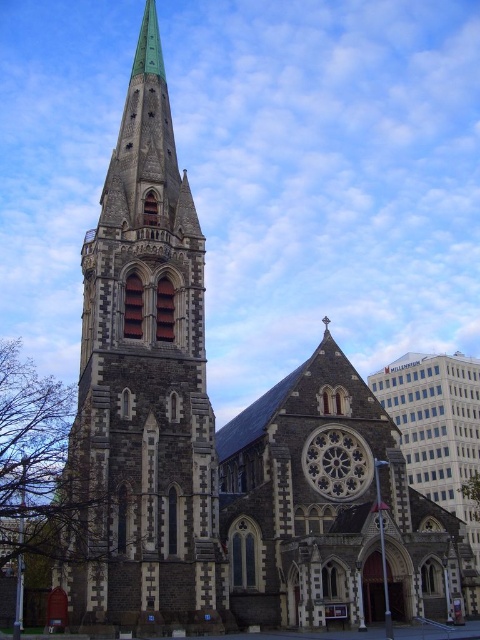
Question: Does stone steeple at left have a greater width compared to dark gray stone clock at center?

Choices:
 (A) yes
 (B) no

Answer: (A)

Question: Can you confirm if stone steeple at left is positioned to the right of dark gray stone clock at center?

Choices:
 (A) yes
 (B) no

Answer: (B)

Question: Can you confirm if stone steeple at left is smaller than dark gray stone clock at center?

Choices:
 (A) no
 (B) yes

Answer: (A)

Question: Among these points, which one is farthest from the camera?

Choices:
 (A) [x=202, y=554]
 (B) [x=335, y=456]

Answer: (B)

Question: Which object is farther from the camera taking this photo?

Choices:
 (A) dark gray stone clock at center
 (B) stone steeple at left

Answer: (A)